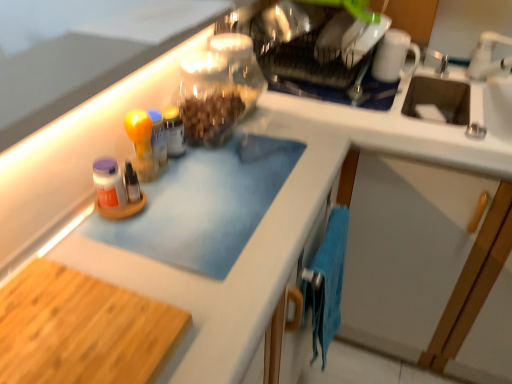
Locate an element on the screen. free spot to the right of white glossy mug at upper right is located at coordinates (441, 77).